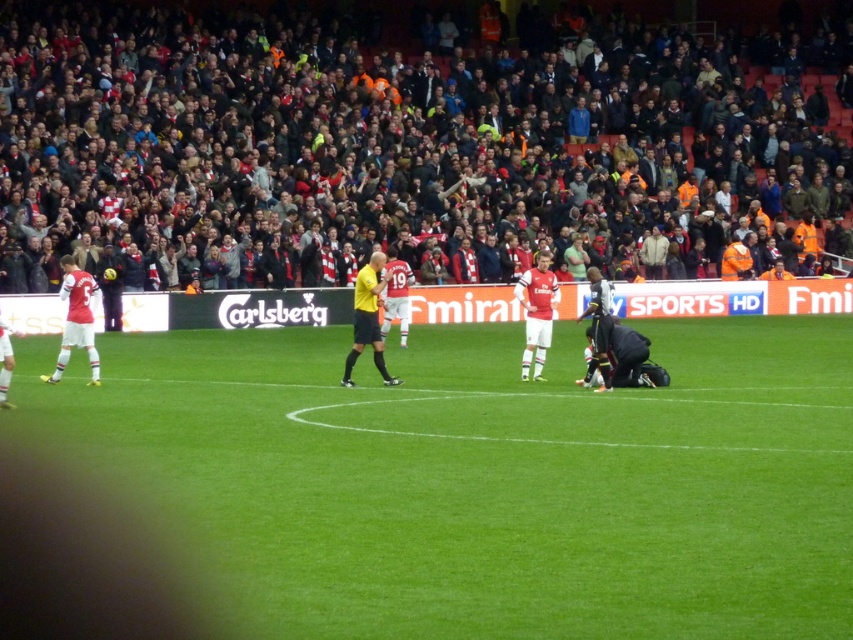
You are a drone operator trying to capture the soccer match. The green grass field at center is represented by point [485,477]. Where should you position your drone to get a clear view of the green grass field at center?

Position the drone at point [485,477] to capture the green grass field at center clearly.

You are a photographer positioned at the edge of the soccer field. You want to take a photo that includes both the green grass field at center and the white jersey at center. Which object will occupy more horizontal space in the photo?

The green grass field at center will occupy more horizontal space in the photo because its width surpasses that of the white jersey at center.

You are a photographer at the soccer match. You want to take a photo that includes both the white jersey at left and the white jersey at center. Which white jersey should you focus on to ensure it appears larger in the photo?

The white jersey at center should be focused on because it is larger than the white jersey at left, so focusing on it will make it appear larger in the photo.